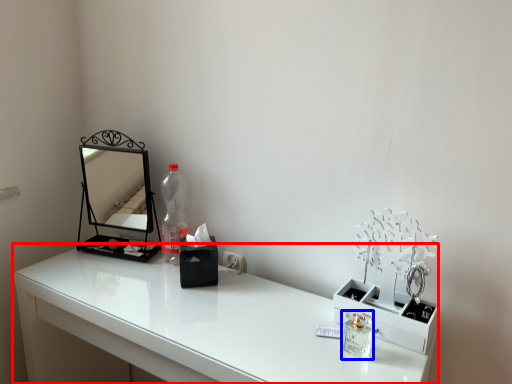
Question: Which point is further to the camera, table (highlighted by a red box) or perfume (highlighted by a blue box)?

Choices:
 (A) table
 (B) perfume

Answer: (B)